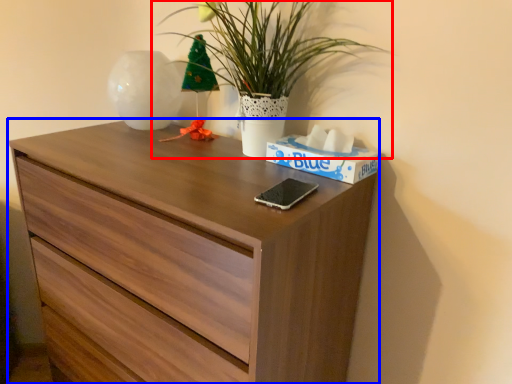
Question: Among these objects, which one is nearest to the camera, houseplant (highlighted by a red box) or chest of drawers (highlighted by a blue box)?

Choices:
 (A) houseplant
 (B) chest of drawers

Answer: (B)